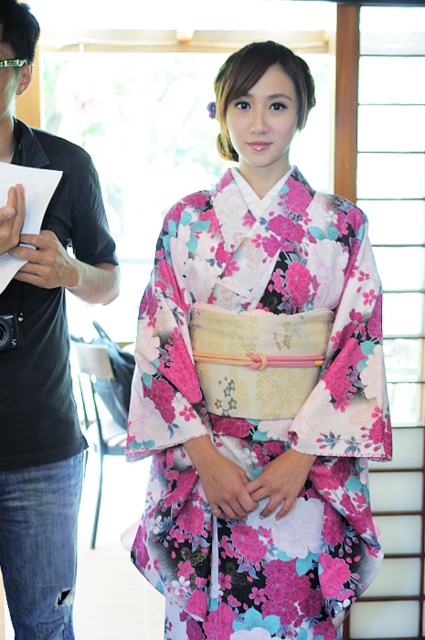
You are a photographer setting up a shoot in a room. You notice two items in the scene, the floral silk kimono at center and the matte black shirt at left. Based on their positions, which item is closer to the floor?

The floral silk kimono at center is located below the matte black shirt at left, so it is closer to the floor.

You are a photographer setting up a photo shoot in the scene described. You need to position a light source so that it illuminates both the floral silk kimono at center and the matte black shirt at left without creating harsh shadows. Considering their relative heights, where should you place the light source?

Since the floral silk kimono at center is shorter than the matte black shirt at left, positioning the light source above and slightly behind both subjects would ensure even illumination while minimizing harsh shadows caused by their differing heights.